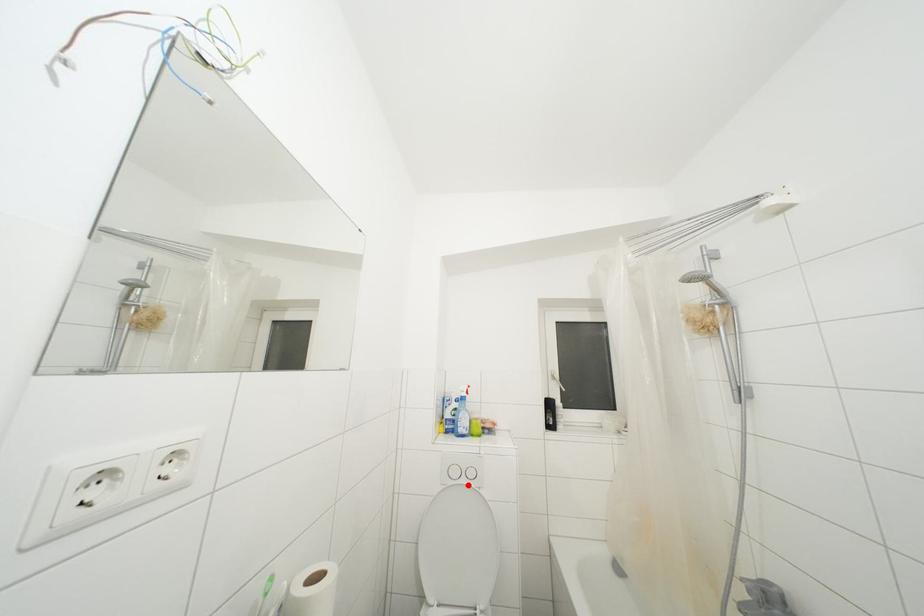
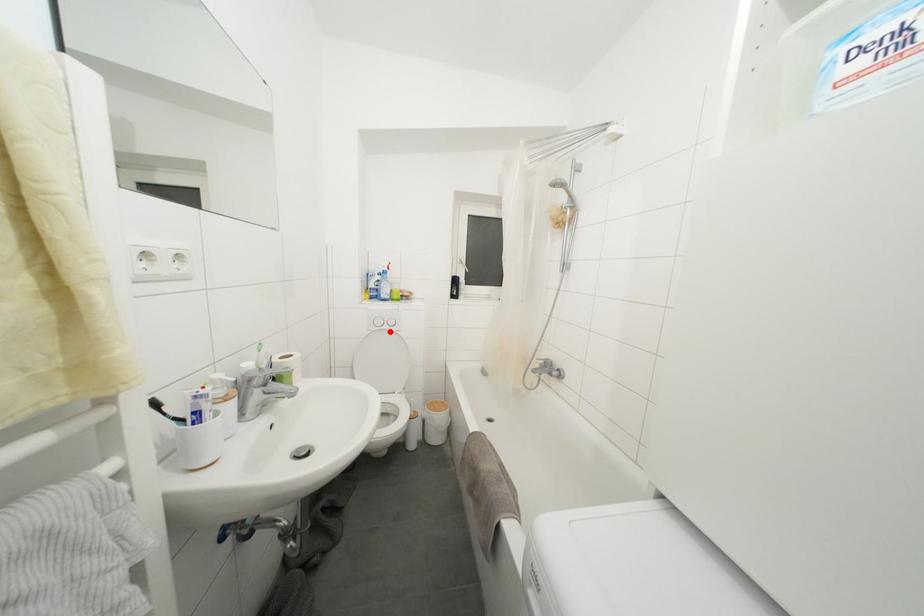
I am providing you with two images of the same scene from different viewpoints. A red point is marked on the first image and another point is marked on the second image. Is the red point in image1 aligned with the point shown in image2?

Yes